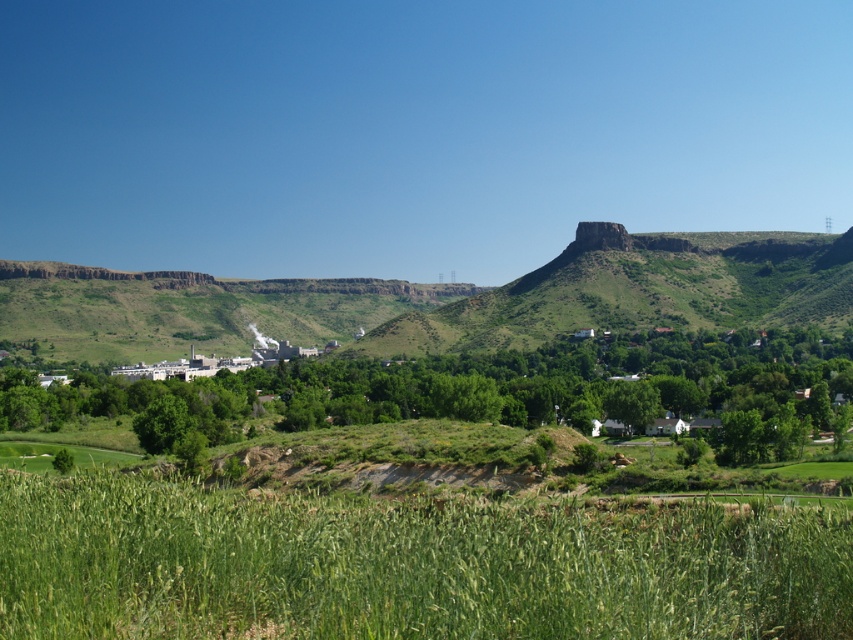
Can you confirm if green grassy field at lower center is shorter than white industrial building at center?

Indeed, green grassy field at lower center has a lesser height compared to white industrial building at center.

Who is shorter, green grassy field at lower center or white industrial building at center?

With less height is green grassy field at lower center.

Does point (39, 536) come farther from viewer compared to point (206, 374)?

That is False.

Where is `green grassy field at lower center`? green grassy field at lower center is located at coordinates (407, 564).